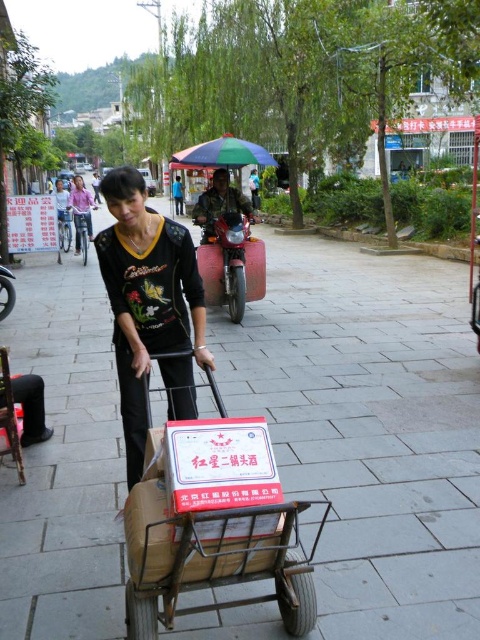
Question: Is matte black shirt at center positioned at the back of blue fabric umbrella at upper center?

Choices:
 (A) no
 (B) yes

Answer: (A)

Question: Which object appears closest to the camera in this image?

Choices:
 (A) blue fabric umbrella at upper center
 (B) metallic helmet at center
 (C) gray concrete pavement at center

Answer: (C)

Question: Considering the real-world distances, which object is farthest from the black floral shirt at center?

Choices:
 (A) blue fabric umbrella at upper center
 (B) metallic helmet at center

Answer: (A)

Question: Is gray concrete pavement at center below metallic brown trolley at center?

Choices:
 (A) yes
 (B) no

Answer: (B)

Question: Which point is farther to the camera?

Choices:
 (A) metallic helmet at center
 (B) metallic brown trolley at center
 (C) gray concrete pavement at center

Answer: (A)

Question: Does metallic brown trolley at center appear over blue fabric umbrella at upper center?

Choices:
 (A) yes
 (B) no

Answer: (B)